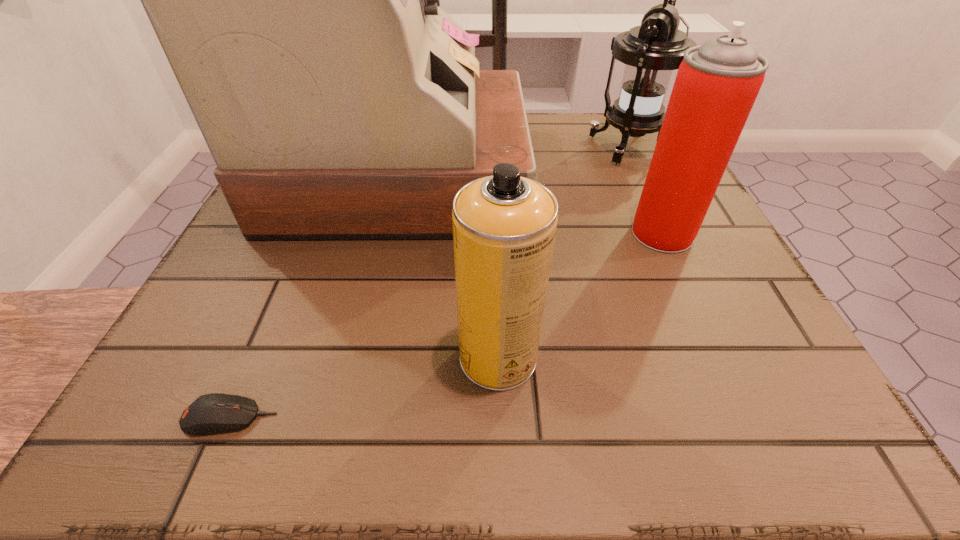
At what (x,y) coordinates should I click in order to perform the action: click on cash register. Please return your answer as a coordinate pair (x, y). Looking at the image, I should click on (297, 0).

Locate an element on the screen. Image resolution: width=960 pixels, height=540 pixels. the right aerosol can is located at coordinates (717, 83).

At what (x,y) coordinates should I click in order to perform the action: click on lantern. Please return your answer as a coordinate pair (x, y). The height and width of the screenshot is (540, 960). Looking at the image, I should click on (651, 51).

Locate an element on the screen. This screenshot has width=960, height=540. the left aerosol can is located at coordinates (504, 226).

At what (x,y) coordinates should I click in order to perform the action: click on the second nearest object. Please return your answer as a coordinate pair (x, y). The width and height of the screenshot is (960, 540). Looking at the image, I should click on (504, 226).

Locate an element on the screen. The width and height of the screenshot is (960, 540). computer mouse is located at coordinates (212, 413).

You are a GUI agent. You are given a task and a screenshot of the screen. Output one action in this format:
    pyautogui.click(x=<x>, y=<y>)
    Task: Click on the shortest object
    
    Given the screenshot: What is the action you would take?
    point(212,413)

At what (x,y) coordinates should I click in order to perform the action: click on vacant area situated 0.130m on the operating side of the cash register. Please return your answer as a coordinate pair (x, y). Looking at the image, I should click on (585, 174).

The width and height of the screenshot is (960, 540). In order to click on free spot located on the left of the farther aerosol can in this screenshot , I will do `click(554, 233)`.

The image size is (960, 540). Find the location of `blank area located 0.200m on the front of the lantern`. blank area located 0.200m on the front of the lantern is located at coordinates (667, 229).